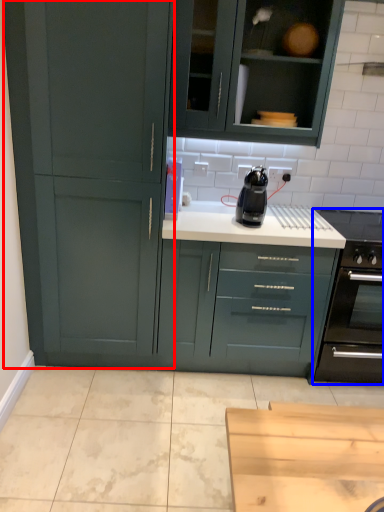
Question: Which of the following is the closest to the observer, cupboard (highlighted by a red box) or home appliance (highlighted by a blue box)?

Choices:
 (A) cupboard
 (B) home appliance

Answer: (A)